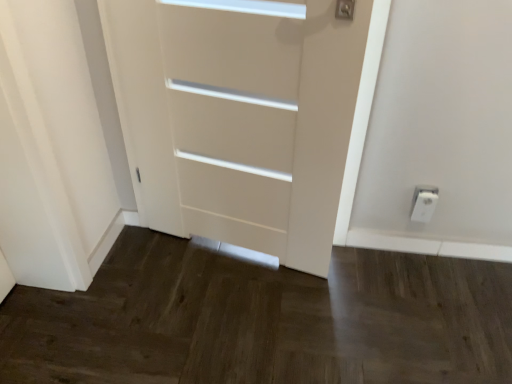
Question: Based on their sizes in the image, would you say white matte door at center is bigger or smaller than white plastic electric outlet at lower right?

Choices:
 (A) big
 (B) small

Answer: (A)

Question: Is white matte door at center wider or thinner than white plastic electric outlet at lower right?

Choices:
 (A) thin
 (B) wide

Answer: (B)

Question: From a real-world perspective, is white matte door at center physically located above or below white plastic electric outlet at lower right?

Choices:
 (A) above
 (B) below

Answer: (A)

Question: Looking at the image, does white plastic electric outlet at lower right seem bigger or smaller compared to white matte door at center?

Choices:
 (A) big
 (B) small

Answer: (B)

Question: Is white plastic electric outlet at lower right taller or shorter than white matte door at center?

Choices:
 (A) short
 (B) tall

Answer: (A)

Question: Choose the correct answer: Is white plastic electric outlet at lower right inside white matte door at center or outside it?

Choices:
 (A) inside
 (B) outside

Answer: (B)

Question: Relative to white matte door at center, is white plastic electric outlet at lower right in front or behind?

Choices:
 (A) behind
 (B) front

Answer: (A)